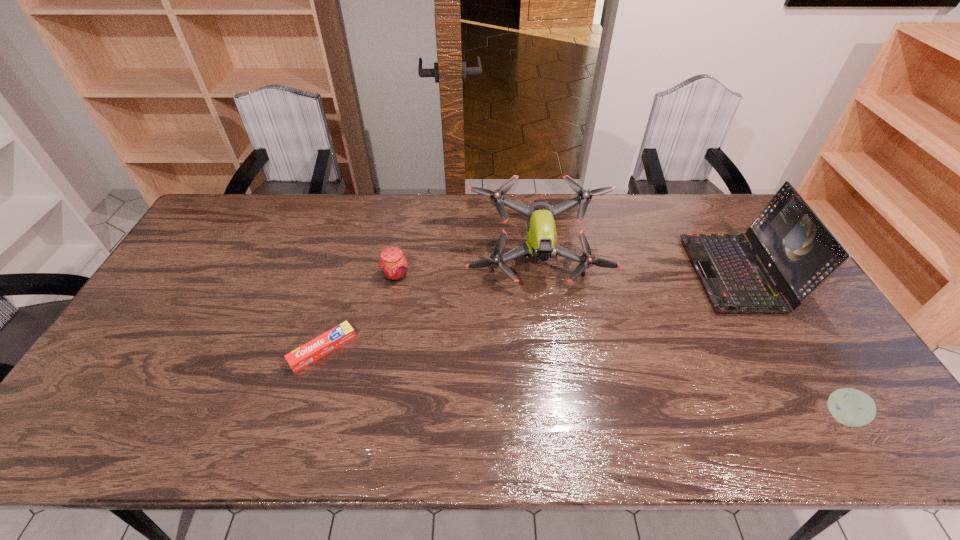
The height and width of the screenshot is (540, 960). I want to click on free space located 0.160m on the left of the fourth object from right to left, so click(330, 275).

The height and width of the screenshot is (540, 960). What are the coordinates of `free location located on the back of the apple` in the screenshot? It's located at (811, 365).

Locate an element on the screen. The height and width of the screenshot is (540, 960). vacant region located 0.390m on the back of the leftmost object is located at coordinates (356, 236).

Identify the location of object that is at the far edge. (541, 234).

Image resolution: width=960 pixels, height=540 pixels. Find the location of `object at the near edge`. object at the near edge is located at coordinates (851, 407).

At what (x,y) coordinates should I click in order to perform the action: click on laptop computer located at the right edge. Please return your answer as a coordinate pair (x, y). The width and height of the screenshot is (960, 540). Looking at the image, I should click on (798, 250).

Locate an element on the screen. This screenshot has width=960, height=540. apple present at the right edge is located at coordinates (851, 407).

At what (x,y) coordinates should I click in order to perform the action: click on object present at the near right corner. Please return your answer as a coordinate pair (x, y). Looking at the image, I should click on (851, 407).

The height and width of the screenshot is (540, 960). I want to click on vacant space at the far edge, so click(348, 201).

Image resolution: width=960 pixels, height=540 pixels. In order to click on free space at the near edge of the desktop in this screenshot , I will do `click(174, 423)`.